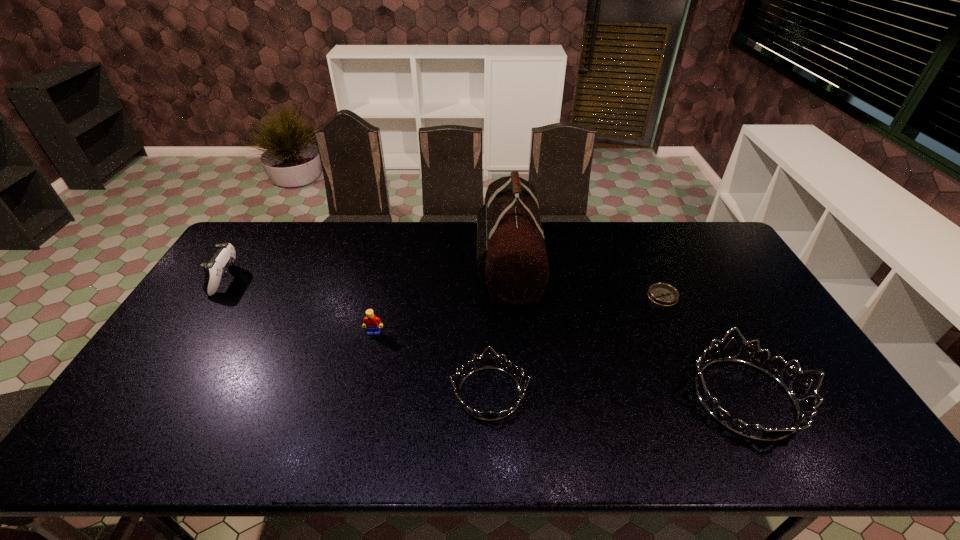
What are the coordinates of `unoccupied position between the control and the fourth farthest object` in the screenshot? It's located at (300, 306).

I want to click on vacant point located between the third nearest object and the taller tiara, so click(x=560, y=366).

Where is `vacant region between the compass and the second object from left to right`? This screenshot has height=540, width=960. vacant region between the compass and the second object from left to right is located at coordinates (518, 314).

The width and height of the screenshot is (960, 540). Identify the location of empty space between the duffel bag and the left tiara. (499, 329).

Locate an element on the screen. This screenshot has width=960, height=540. free point between the tallest object and the right tiara is located at coordinates (627, 331).

Locate an element on the screen. The image size is (960, 540). object that is the second closest to the taller tiara is located at coordinates coord(511,254).

Where is `object that is the fifth closest to the duffel bag`? This screenshot has height=540, width=960. object that is the fifth closest to the duffel bag is located at coordinates (217, 268).

Where is `free location that satisfies the following two spatial constraints: 1. on the front pocket of the tallest object; 2. on the right side of the compass`? This screenshot has width=960, height=540. free location that satisfies the following two spatial constraints: 1. on the front pocket of the tallest object; 2. on the right side of the compass is located at coordinates (511, 296).

This screenshot has width=960, height=540. Find the location of `free space that satisfies the following two spatial constraints: 1. on the front pocket of the tallest object; 2. on the front-facing side of the shorter tiara`. free space that satisfies the following two spatial constraints: 1. on the front pocket of the tallest object; 2. on the front-facing side of the shorter tiara is located at coordinates (517, 393).

This screenshot has width=960, height=540. I want to click on free space that satisfies the following two spatial constraints: 1. on the front-facing side of the control; 2. on the back side of the shortest object, so coord(216,296).